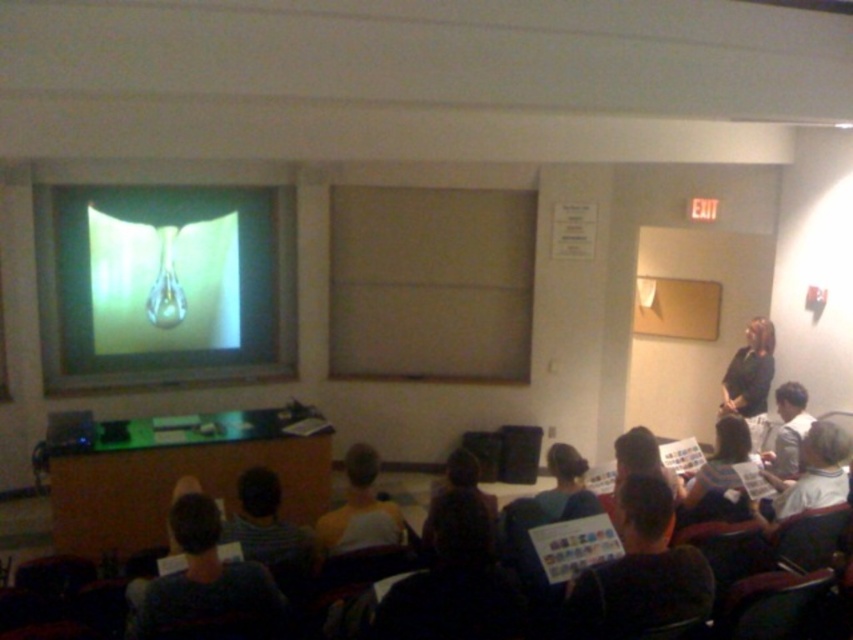
Does translucent glass screen at upper left have a greater height compared to dark gray shirt at lower left?

Indeed, translucent glass screen at upper left has a greater height compared to dark gray shirt at lower left.

Measure the distance between translucent glass screen at upper left and dark gray shirt at lower left.

translucent glass screen at upper left is 11.79 feet from dark gray shirt at lower left.

The height and width of the screenshot is (640, 853). I want to click on translucent glass screen at upper left, so click(x=166, y=284).

Can you confirm if translucent glass screen at upper left is bigger than dark gray sweater at center?

Yes.

Can you confirm if translucent glass screen at upper left is positioned below dark gray sweater at center?

No.

Who is more distant from viewer, (125, 353) or (595, 611)?

Point (125, 353)

Where is `translucent glass screen at upper left`? The image size is (853, 640). translucent glass screen at upper left is located at coordinates (166, 284).

Between point (618, 573) and point (393, 515), which one is positioned behind?

Point (393, 515)

Locate an element on the screen. The width and height of the screenshot is (853, 640). dark gray sweater at center is located at coordinates (639, 572).

Where is `dark gray sweater at center`? This screenshot has width=853, height=640. dark gray sweater at center is located at coordinates (639, 572).